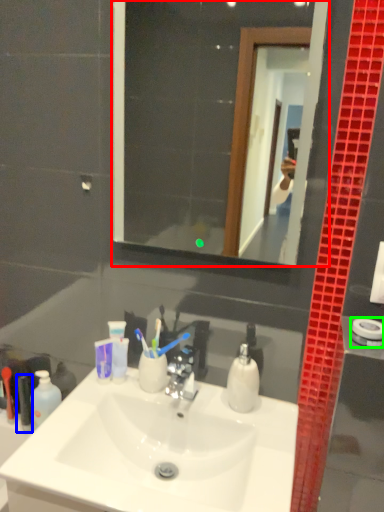
Question: Based on their relative distances, which object is nearer to mirror (highlighted by a red box)? Choose from toiletry (highlighted by a blue box) and towel bar (highlighted by a green box).

Choices:
 (A) toiletry
 (B) towel bar

Answer: (A)